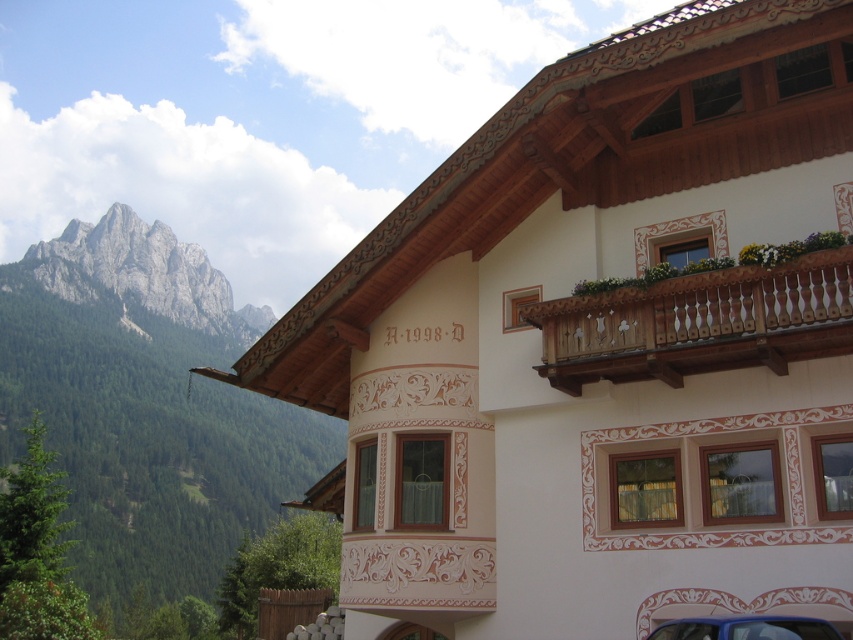
Question: Which point appears farthest from the camera in this image?

Choices:
 (A) (4, 412)
 (B) (125, 268)

Answer: (B)

Question: Among these objects, which one is farthest from the camera?

Choices:
 (A) rugged stone mountain at left
 (B) gray rocky mountain at upper left
 (C) blue glossy car at lower right
 (D) wooden at upper right

Answer: (B)

Question: Does wooden at upper right have a greater width compared to blue glossy car at lower right?

Choices:
 (A) yes
 (B) no

Answer: (A)

Question: Can you confirm if gray rocky mountain at upper left is wider than blue glossy car at lower right?

Choices:
 (A) no
 (B) yes

Answer: (B)

Question: Among these objects, which one is farthest from the camera?

Choices:
 (A) blue glossy car at lower right
 (B) rugged stone mountain at left

Answer: (B)

Question: Is gray rocky mountain at upper left positioned behind blue glossy car at lower right?

Choices:
 (A) yes
 (B) no

Answer: (A)